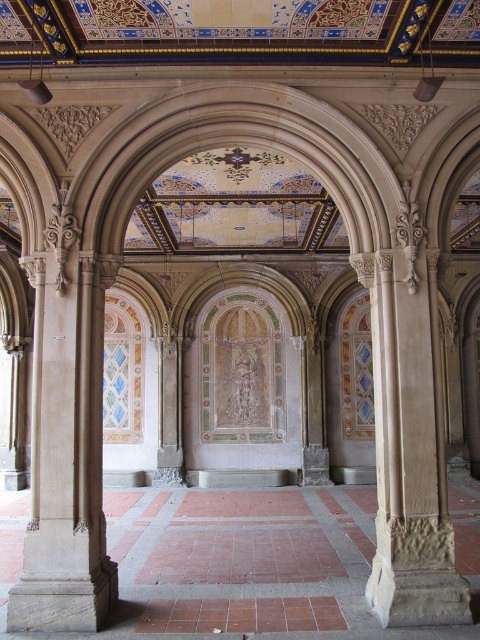
Question: Does smooth stone column at left have a smaller size compared to beige stone column at right?

Choices:
 (A) yes
 (B) no

Answer: (B)

Question: Does smooth stone column at left have a greater width compared to beige stone column at right?

Choices:
 (A) yes
 (B) no

Answer: (A)

Question: Can you confirm if smooth stone column at left is positioned above beige stone column at right?

Choices:
 (A) yes
 (B) no

Answer: (A)

Question: Which of the following is the farthest from the observer?

Choices:
 (A) beige stone column at right
 (B) smooth stone column at left

Answer: (B)

Question: Which of the following is the closest to the observer?

Choices:
 (A) beige stone column at right
 (B) smooth stone column at left

Answer: (A)

Question: Which object is farther from the camera taking this photo?

Choices:
 (A) smooth stone column at left
 (B) beige stone column at right

Answer: (A)